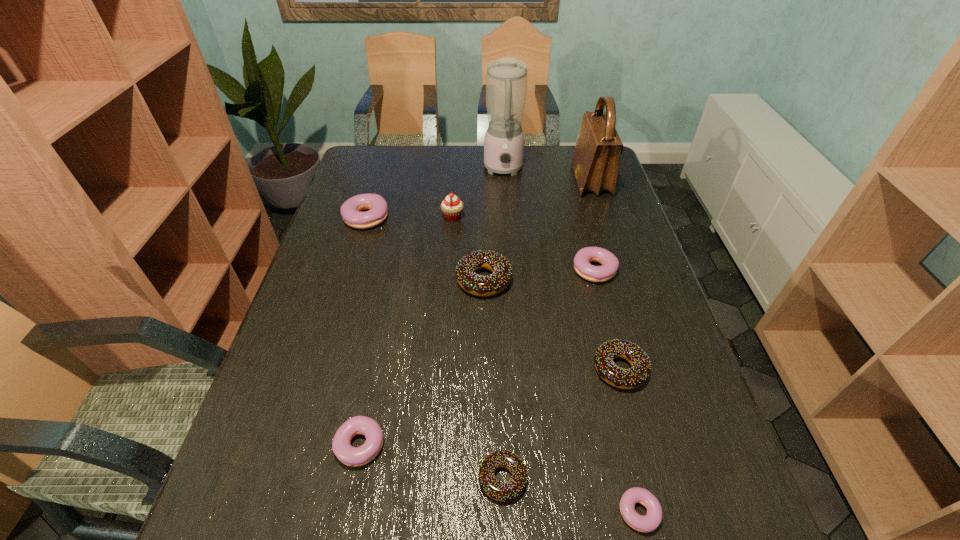
Choose which doughnut is the second nearest neighbor to the tallest object. Please provide its 2D coordinates. Your answer should be formatted as a tuple, i.e. [(x, y)], where the tuple contains the x and y coordinates of a point satisfying the conditions above.

[(610, 263)]

Where is `purple doughnut that is the nearest to the biggest purple doughnut`? The height and width of the screenshot is (540, 960). purple doughnut that is the nearest to the biggest purple doughnut is located at coordinates (610, 263).

Where is `the second closest purple doughnut to the smallest purple doughnut`? the second closest purple doughnut to the smallest purple doughnut is located at coordinates (610, 263).

Choose which chocolate doughnut is the nearest neighbor to the fourth farthest doughnut. Please provide its 2D coordinates. Your answer should be formatted as a tuple, i.e. [(x, y)], where the tuple contains the x and y coordinates of a point satisfying the conditions above.

[(507, 491)]

Identify which chocolate doughnut is the second closest to the rightmost chocolate doughnut. Please provide its 2D coordinates. Your answer should be formatted as a tuple, i.e. [(x, y)], where the tuple contains the x and y coordinates of a point satisfying the conditions above.

[(475, 284)]

This screenshot has height=540, width=960. Identify the location of free space that satisfies the following two spatial constraints: 1. on the front flap of the shoulder bag; 2. on the front side of the pink cupcake. (603, 217).

What are the coordinates of `vacant region that satisfies the following two spatial constraints: 1. on the base of the second biggest chocolate doughnut near the control knob; 2. on the left side of the food processor` in the screenshot? It's located at (517, 369).

Locate an element on the screen. The image size is (960, 540). free space that satisfies the following two spatial constraints: 1. on the front flap of the ninth shortest object; 2. on the front side of the smallest chocolate doughnut is located at coordinates (687, 478).